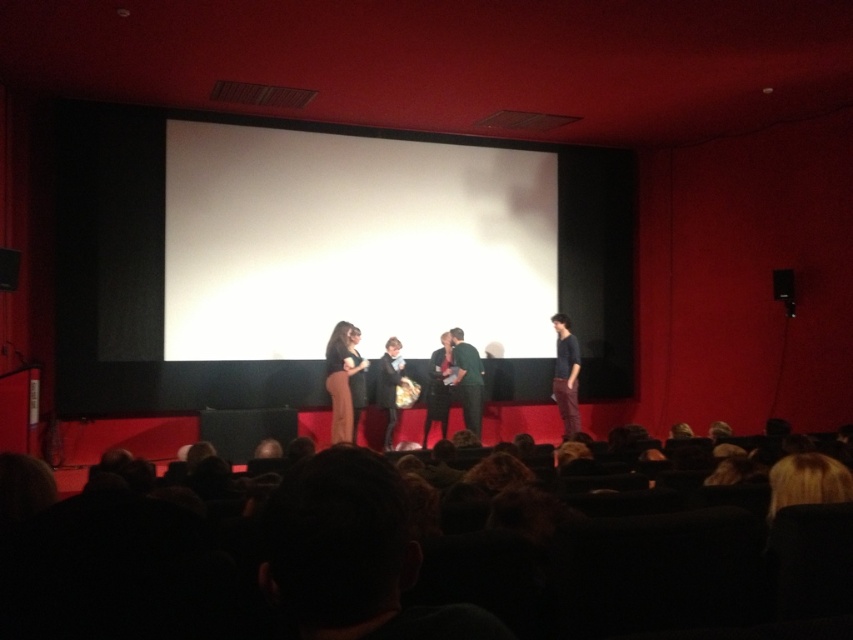
You are sitting in the audience of the movie theater and want to see both the dark blue shirt at center and the green fabric dress at center clearly. Which one might be harder to see because it is farther away from you?

The green fabric dress at center is behind dark blue shirt at center, so it is farther away from you and might be harder to see.

You are sitting in the audience of the movie theater scene. You notice two performers on stage wearing a green fabric dress at center and a velvet black coat at center. Which one is positioned to the right side of the other?

The green fabric dress at center is positioned to the right of the velvet black coat at center.

You are sitting in the audience of the movie theater scene. You notice two performers on stage wearing a green fabric dress at center and a velvet black coat at center. Which performer is positioned closer to the back of the stage?

The velvet black coat at center is positioned behind the green fabric dress at center, so the performer wearing the velvet black coat at center is closer to the back of the stage.